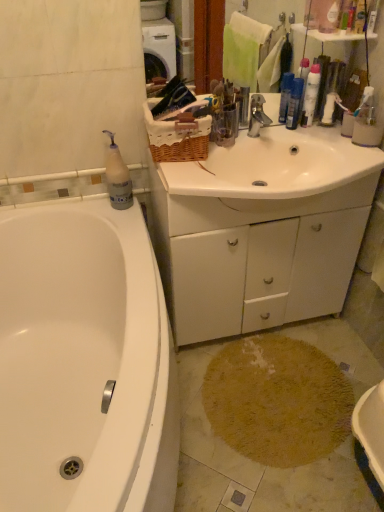
Question: Does translucent plastic bottle at upper left, marked as the 2th cleaning product in a right-to-left arrangement, have a lesser height compared to blue plastic bottles at upper right, the 2th toiletry from the top?

Choices:
 (A) yes
 (B) no

Answer: (B)

Question: From the image's perspective, is translucent plastic bottle at upper left, arranged as the 1th cleaning product when ordered from the bottom, above blue plastic bottles at upper right, the 2th toiletry when ordered from front to back?

Choices:
 (A) yes
 (B) no

Answer: (B)

Question: Does translucent plastic bottle at upper left, arranged as the 1th cleaning product when ordered from the bottom, have a smaller size compared to blue plastic bottles at upper right, the first toiletry from the back?

Choices:
 (A) no
 (B) yes

Answer: (A)

Question: Can you confirm if translucent plastic bottle at upper left, the first cleaning product from the left, is wider than blue plastic bottles at upper right, the second toiletry in the right-to-left sequence?

Choices:
 (A) yes
 (B) no

Answer: (A)

Question: Is blue plastic bottles at upper right, the 2th toiletry from the top, a part of translucent plastic bottle at upper left, arranged as the 1th cleaning product when ordered from the bottom?

Choices:
 (A) yes
 (B) no

Answer: (B)

Question: From a real-world perspective, is translucent plastic bottle at upper left, the first cleaning product from the left, below blue plastic bottles at upper right, the first toiletry from the back?

Choices:
 (A) yes
 (B) no

Answer: (A)

Question: Is white glossy bathtub at lower left not near metallic silver faucet at center?

Choices:
 (A) no
 (B) yes

Answer: (A)

Question: Is white glossy bathtub at lower left positioned in front of metallic silver faucet at center?

Choices:
 (A) no
 (B) yes

Answer: (B)

Question: Can metallic silver faucet at center be found inside white glossy bathtub at lower left?

Choices:
 (A) yes
 (B) no

Answer: (B)

Question: Is white glossy bathtub at lower left wider than metallic silver faucet at center?

Choices:
 (A) yes
 (B) no

Answer: (A)

Question: Is white glossy bathtub at lower left bigger than metallic silver faucet at center?

Choices:
 (A) no
 (B) yes

Answer: (B)

Question: Is white glossy bathtub at lower left at the right side of metallic silver faucet at center?

Choices:
 (A) yes
 (B) no

Answer: (B)

Question: Is white glossy sink at center smaller than white matte cabinet at center?

Choices:
 (A) yes
 (B) no

Answer: (A)